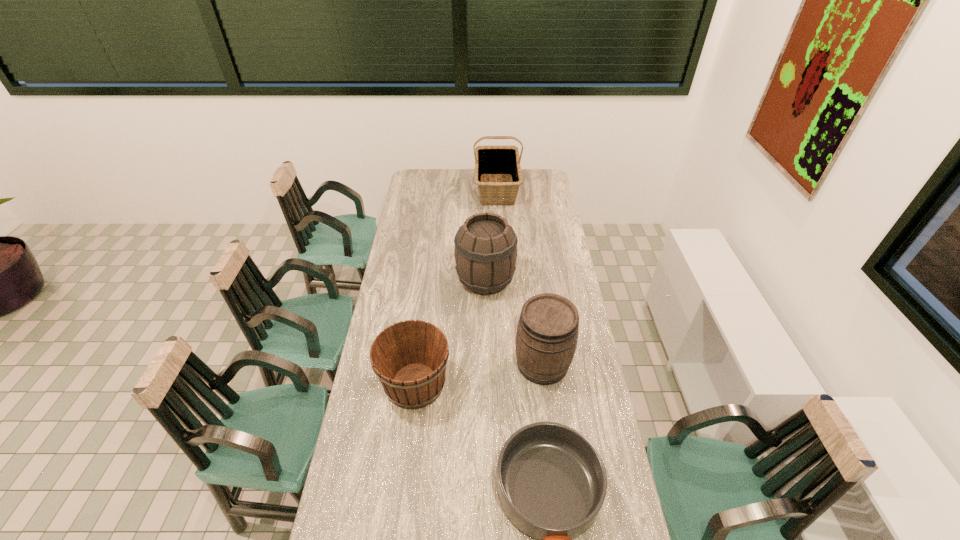
Find the location of a particular element. The width and height of the screenshot is (960, 540). vacant space at the right edge of the desktop is located at coordinates (x=581, y=322).

The image size is (960, 540). In order to click on free space at the far left corner of the desktop in this screenshot , I will do `click(409, 180)`.

In the image, there is a desktop. Identify the location of free space at the far right corner. The height and width of the screenshot is (540, 960). (530, 171).

Identify the location of the closest object relative to the fourth nearest object. The height and width of the screenshot is (540, 960). (547, 332).

Locate an element on the screen. This screenshot has height=540, width=960. object that is the closest to the fourth tallest object is located at coordinates (551, 482).

In order to click on the second closest wine bucket to the second shortest object in this screenshot , I will do `click(485, 252)`.

Choose which wine bucket is the second nearest neighbor to the basket. Please provide its 2D coordinates. Your answer should be formatted as a tuple, i.e. [(x, y)], where the tuple contains the x and y coordinates of a point satisfying the conditions above.

[(547, 332)]